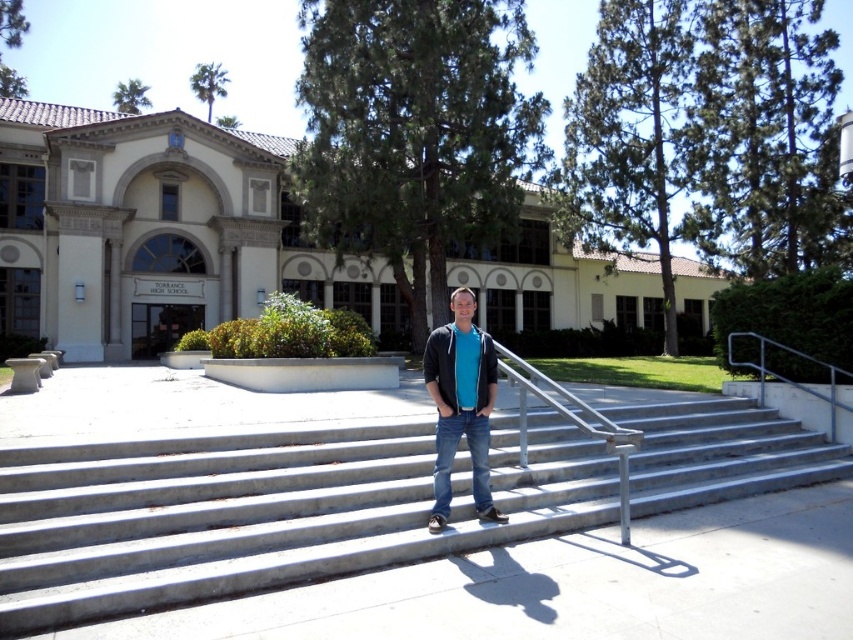
Question: Which point appears farthest from the camera in this image?

Choices:
 (A) (474, 326)
 (B) (761, 365)

Answer: (B)

Question: Does matte blue shirt at center have a larger size compared to blue denim jeans at center?

Choices:
 (A) yes
 (B) no

Answer: (A)

Question: Which object is positioned closest to the matte blue shirt at center?

Choices:
 (A) blue denim jeans at center
 (B) silver metallic handrail at upper right
 (C) matte black shirt at center

Answer: (A)

Question: Estimate the real-world distances between objects in this image. Which object is closer to the silver metallic handrail at upper right?

Choices:
 (A) concrete stairs at center
 (B) matte blue shirt at center
 (C) matte black shirt at center

Answer: (A)

Question: Does silver metallic handrail at upper right have a smaller size compared to matte black shirt at center?

Choices:
 (A) no
 (B) yes

Answer: (A)

Question: Observing the image, what is the correct spatial positioning of matte blue shirt at center in reference to matte black shirt at center?

Choices:
 (A) left
 (B) right

Answer: (B)